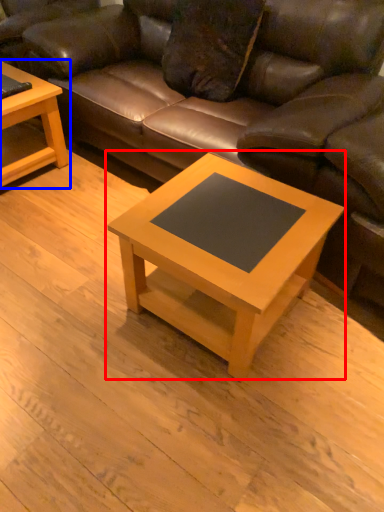
Question: Which point is closer to the camera, coffee table (highlighted by a red box) or coffee table (highlighted by a blue box)?

Choices:
 (A) coffee table
 (B) coffee table

Answer: (A)